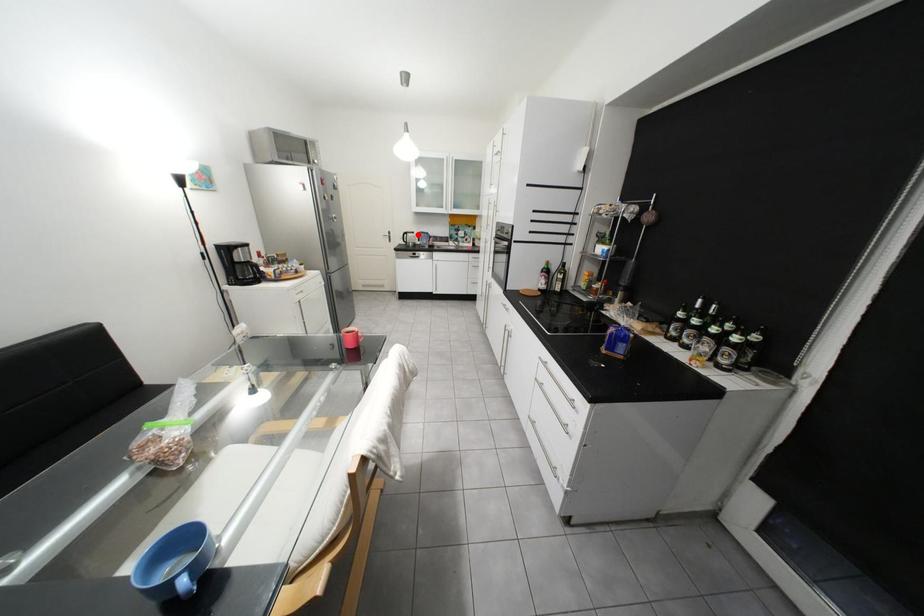
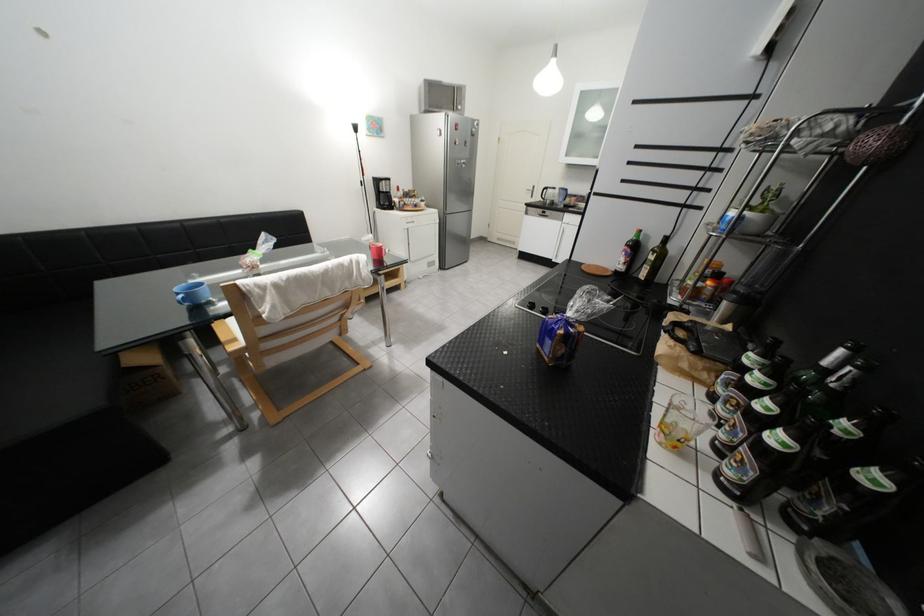
In the second image, find the point that corresponds to the highlighted location in the first image.

(557, 190)